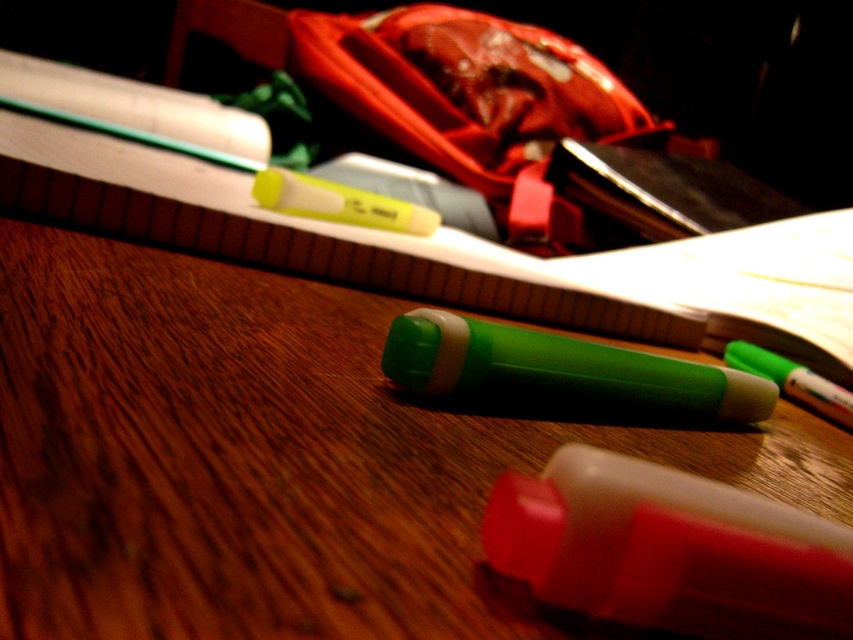
What is located at the coordinates point (669, 550) on the desk?

The translucent white crayon at center is located at point (669, 550) on the desk.

You are organizing stationery on a desk and need to place a new ruler between the green plastic highlighter at center and the translucent white crayon at center. If the ruler is 12 inches long, will it fit between them without overlapping either item?

The distance between the green plastic highlighter at center and the translucent white crayon at center is 11.12 inches. Since the ruler is 12 inches long, it is slightly longer than the space available. Therefore, the ruler will not fit between them without overlapping either item.

What are the coordinates of the translucent white crayon at center on the desk?

The translucent white crayon at center is located at coordinates point (669, 550).